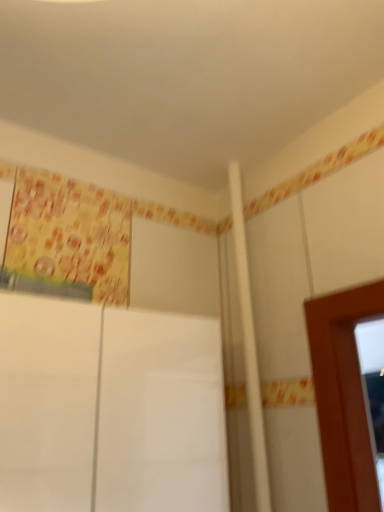
Measure the distance between white glossy screen door at lower left and camera.

They are 25.79 inches apart.

Describe the element at coordinates (161, 415) in the screenshot. I see `white glossy screen door at lower left` at that location.

Image resolution: width=384 pixels, height=512 pixels. In order to click on white glossy screen door at lower left in this screenshot , I will do `click(161, 415)`.

The image size is (384, 512). What are the coordinates of `white glossy screen door at lower left` in the screenshot? It's located at (161, 415).